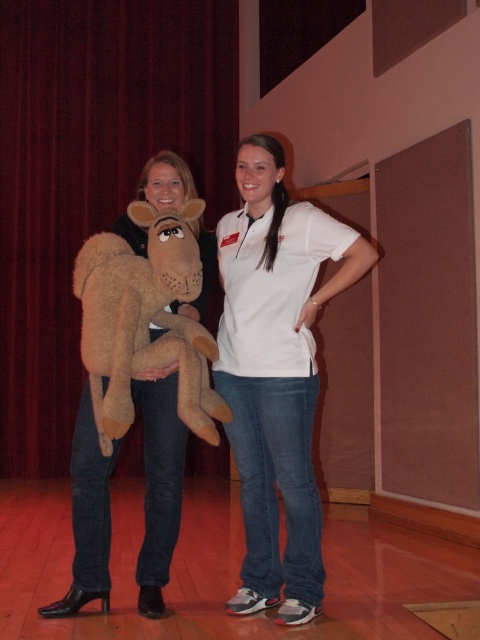
Question: Is white cotton shirt at center wider than brown plush toy at center?

Choices:
 (A) yes
 (B) no

Answer: (A)

Question: Is brown plush toy at center smaller than brown plush toy at left?

Choices:
 (A) yes
 (B) no

Answer: (B)

Question: Which point is farther to the camera?

Choices:
 (A) white cotton shirt at center
 (B) dark red velvet curtain at upper left
 (C) brown plush toy at left
 (D) brown plush toy at center

Answer: (B)

Question: Among these points, which one is nearest to the camera?

Choices:
 (A) (82, 419)
 (B) (294, 472)
 (C) (206, 157)
 (D) (170, 324)

Answer: (B)

Question: Which of the following is the closest to the observer?

Choices:
 (A) (203, 195)
 (B) (108, 444)

Answer: (B)

Question: Is brown plush toy at center below brown plush toy at left?

Choices:
 (A) yes
 (B) no

Answer: (B)